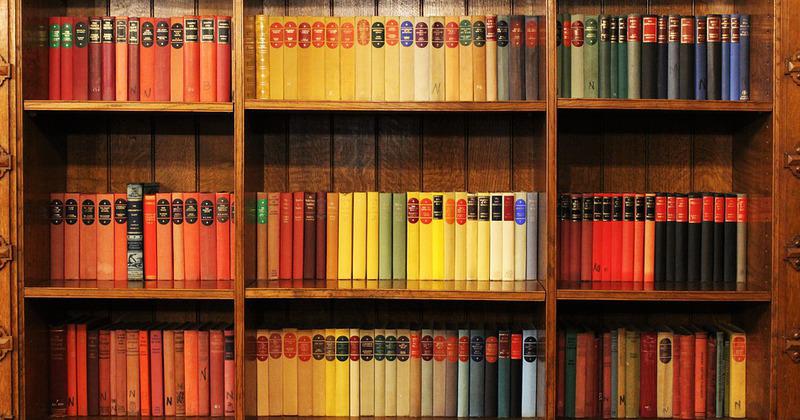
I want to click on shelves, so click(x=98, y=104), click(x=340, y=105), click(x=604, y=103), click(x=640, y=294), click(x=478, y=297), click(x=182, y=288).